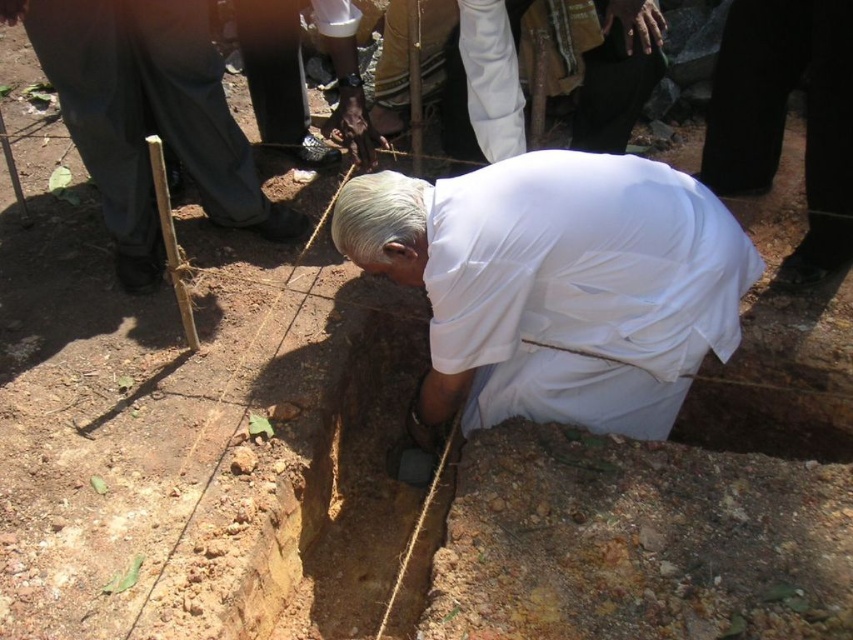
Question: Among these points, which one is nearest to the camera?

Choices:
 (A) (669, 289)
 (B) (51, 35)
 (C) (735, 164)

Answer: (A)

Question: Does white cloth at center have a smaller size compared to white cloth at lower right?

Choices:
 (A) yes
 (B) no

Answer: (B)

Question: Estimate the real-world distances between objects in this image. Which object is farther from the smooth wooden stick at lower left?

Choices:
 (A) white cloth at lower right
 (B) white cloth at center
 (C) brown dirt crack at lower center

Answer: (A)

Question: Can you confirm if white cloth at center is smaller than brown dirt crack at lower center?

Choices:
 (A) no
 (B) yes

Answer: (B)

Question: Does white cloth at lower right have a lesser width compared to brown dirt crack at lower center?

Choices:
 (A) yes
 (B) no

Answer: (B)

Question: Among these points, which one is farthest from the camera?

Choices:
 (A) (219, 452)
 (B) (468, 252)
 (C) (840, 195)

Answer: (C)